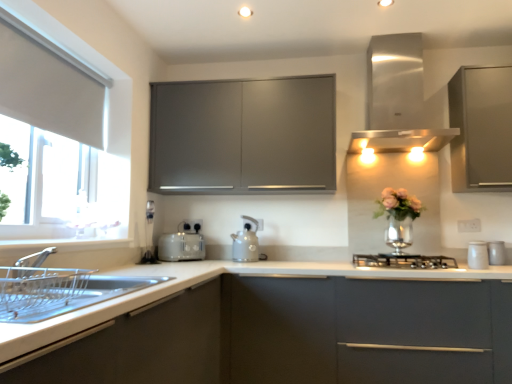
Question: From a real-world perspective, is white matte countertop at center below matte gray cabinet at center, the first cabinetry positioned from the back?

Choices:
 (A) yes
 (B) no

Answer: (A)

Question: Is white matte countertop at center further to camera compared to matte gray cabinet at center, which is the second cabinetry in right-to-left order?

Choices:
 (A) yes
 (B) no

Answer: (B)

Question: Does white matte countertop at center have a lesser height compared to matte gray cabinet at center, which is the 3th cabinetry from front to back?

Choices:
 (A) no
 (B) yes

Answer: (A)

Question: Can you confirm if white matte countertop at center is thinner than matte gray cabinet at center, which is the 3th cabinetry from front to back?

Choices:
 (A) yes
 (B) no

Answer: (B)

Question: Does white matte countertop at center turn towards matte gray cabinet at center, which is the second cabinetry in right-to-left order?

Choices:
 (A) no
 (B) yes

Answer: (A)

Question: Considering the positions of matte gray kettle at center and white glossy canister at right, placed as the 1th appliance when sorted from right to left, in the image, is matte gray kettle at center taller or shorter than white glossy canister at right, placed as the 1th appliance when sorted from right to left,?

Choices:
 (A) tall
 (B) short

Answer: (A)

Question: Considering the relative positions of matte gray kettle at center and white glossy canister at right, which is the second appliance in back-to-front order, in the image provided, is matte gray kettle at center to the left or to the right of white glossy canister at right, which is the second appliance in back-to-front order,?

Choices:
 (A) right
 (B) left

Answer: (B)

Question: From the image's perspective, is matte gray kettle at center positioned above or below white glossy canister at right, which is the second appliance in back-to-front order?

Choices:
 (A) above
 (B) below

Answer: (A)

Question: Do you think matte gray kettle at center is within white glossy canister at right, which is the second appliance in back-to-front order, or outside of it?

Choices:
 (A) inside
 (B) outside

Answer: (B)

Question: Is matte gray cabinet at upper right, the second cabinetry when ordered from back to front, in front of or behind white glossy sink at lower left, which ranks as the third cabinetry in back-to-front order, in the image?

Choices:
 (A) behind
 (B) front

Answer: (A)

Question: From a real-world perspective, relative to white glossy sink at lower left, which is the 1th cabinetry in left-to-right order, is matte gray cabinet at upper right, the second cabinetry when ordered from back to front, vertically above or below?

Choices:
 (A) below
 (B) above

Answer: (B)

Question: In the image, is matte gray cabinet at upper right, the first cabinetry from the right, on the left side or the right side of white glossy sink at lower left, arranged as the 3th cabinetry when viewed from the right?

Choices:
 (A) left
 (B) right

Answer: (B)

Question: Looking at their shapes, would you say matte gray cabinet at upper right, the 2th cabinetry viewed from the front, is wider or thinner than white glossy sink at lower left, which is the 1th cabinetry in left-to-right order?

Choices:
 (A) wide
 (B) thin

Answer: (B)

Question: From their relative heights in the image, would you say stainless steel vent at upper right is taller or shorter than white fabric at left?

Choices:
 (A) short
 (B) tall

Answer: (B)

Question: Based on their positions, is stainless steel vent at upper right located to the left or right of white fabric at left?

Choices:
 (A) left
 (B) right

Answer: (B)